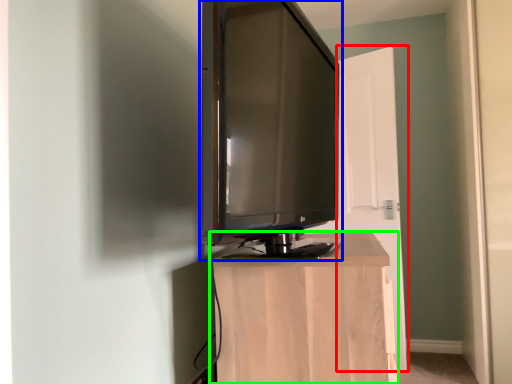
Question: Which is nearer to the door (highlighted by a red box)? television (highlighted by a blue box) or furniture (highlighted by a green box).

Choices:
 (A) television
 (B) furniture

Answer: (A)